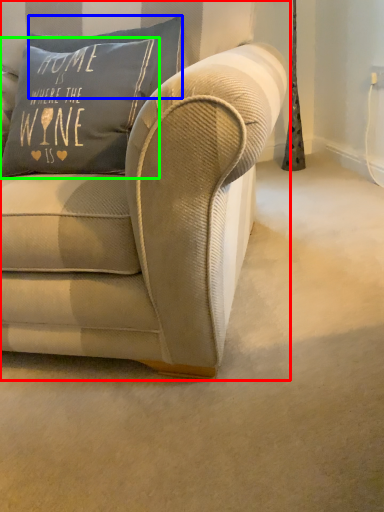
Question: Which is nearer to the studio couch (highlighted by a red box)? pillow (highlighted by a blue box) or pillow (highlighted by a green box).

Choices:
 (A) pillow
 (B) pillow

Answer: (B)